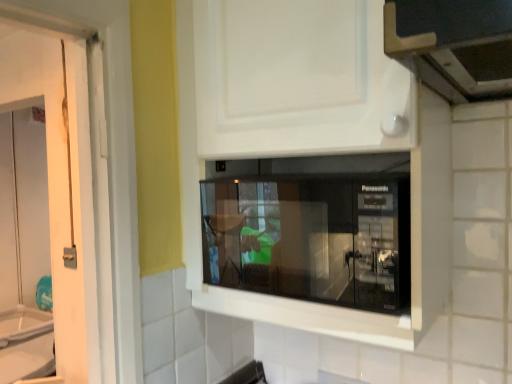
Question: Looking at their shapes, would you say black glossy microwave at center is wider or thinner than matte black microwave at center?

Choices:
 (A) wide
 (B) thin

Answer: (B)

Question: Would you say black glossy microwave at center is inside or outside matte black microwave at center?

Choices:
 (A) outside
 (B) inside

Answer: (B)

Question: In terms of size, does black glossy microwave at center appear bigger or smaller than matte black microwave at center?

Choices:
 (A) small
 (B) big

Answer: (A)

Question: In the image, is matte black microwave at center on the left side or the right side of black glossy microwave at center?

Choices:
 (A) left
 (B) right

Answer: (B)

Question: From their relative heights in the image, would you say matte black microwave at center is taller or shorter than black glossy microwave at center?

Choices:
 (A) short
 (B) tall

Answer: (B)

Question: From a real-world perspective, relative to black glossy microwave at center, is matte black microwave at center vertically above or below?

Choices:
 (A) above
 (B) below

Answer: (A)

Question: Is point (400, 84) positioned closer to the camera than point (240, 193)?

Choices:
 (A) closer
 (B) farther

Answer: (A)